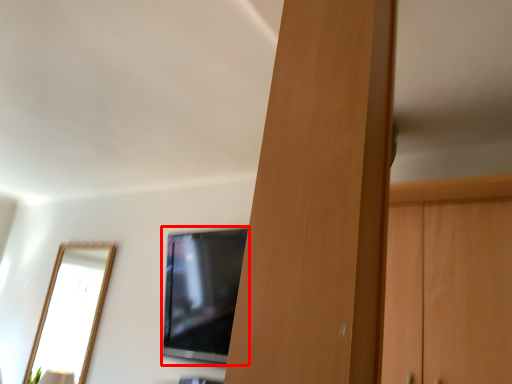
Question: From the image's perspective, what is the correct spatial relationship of television (annotated by the red box) in relation to door?

Choices:
 (A) above
 (B) below

Answer: (B)